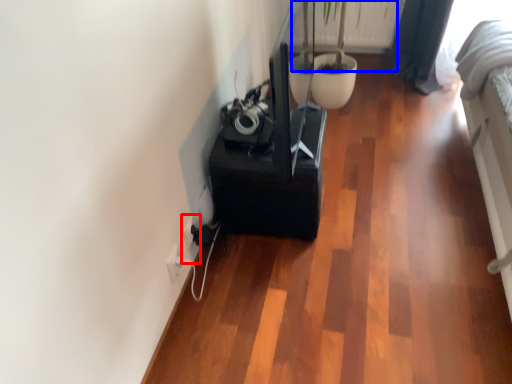
Question: Which object is closer to the camera taking this photo, electric outlet (highlighted by a red box) or plant (highlighted by a blue box)?

Choices:
 (A) electric outlet
 (B) plant

Answer: (A)